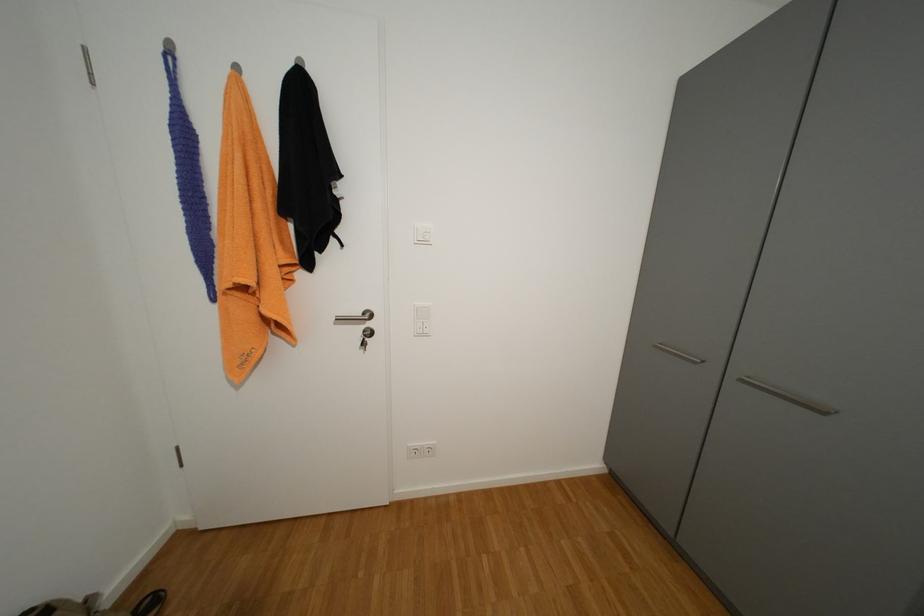
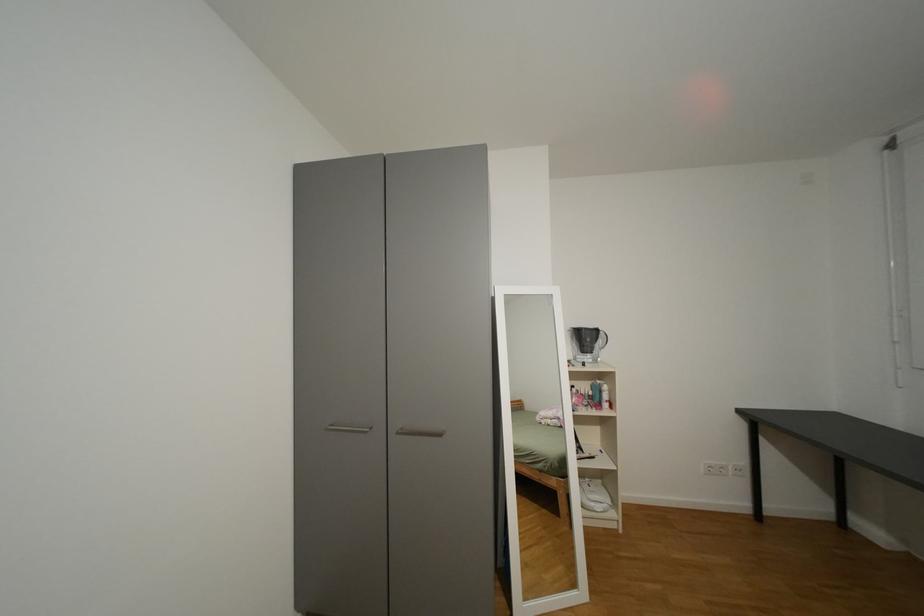
Question: How did the camera likely rotate?

Choices:
 (A) Left
 (B) Right
 (C) Up
 (D) Down

Answer: (B)